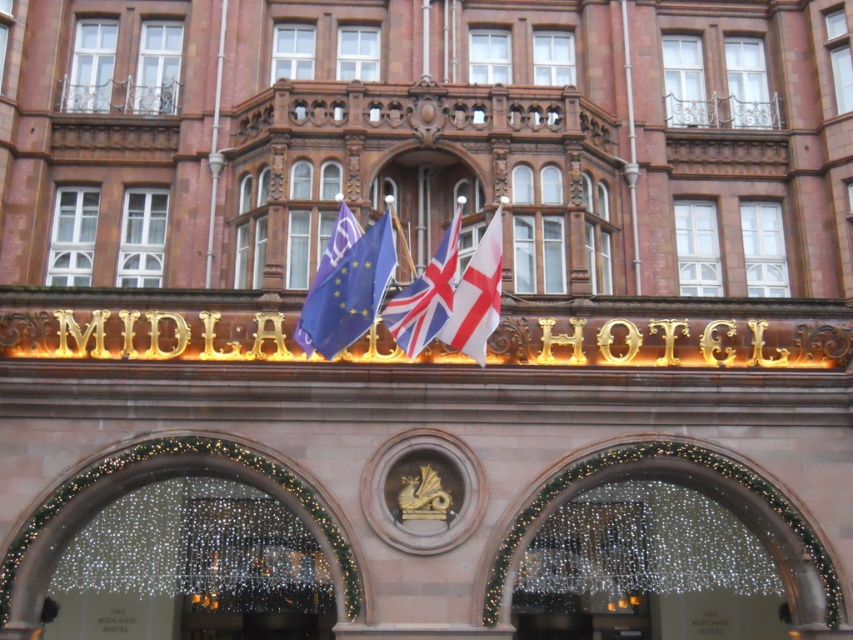
Question: Can you confirm if blue fabric flag at center is bigger than polyester flag at center?

Choices:
 (A) no
 (B) yes

Answer: (A)

Question: Based on their relative distances, which object is farther from the polyester flag at center?

Choices:
 (A) blue fabric flag at center
 (B) white fabric flag at center

Answer: (A)

Question: Estimate the real-world distances between objects in this image. Which object is closer to the white fabric flag at center?

Choices:
 (A) polyester flag at center
 (B) blue fabric flag at center

Answer: (A)

Question: Is white fabric flag at center further to camera compared to polyester flag at center?

Choices:
 (A) yes
 (B) no

Answer: (B)

Question: Which point appears closest to the camera in this image?

Choices:
 (A) (334, 301)
 (B) (474, 253)
 (C) (402, 292)

Answer: (A)

Question: Can you confirm if blue fabric flag at center is positioned above polyester flag at center?

Choices:
 (A) no
 (B) yes

Answer: (A)